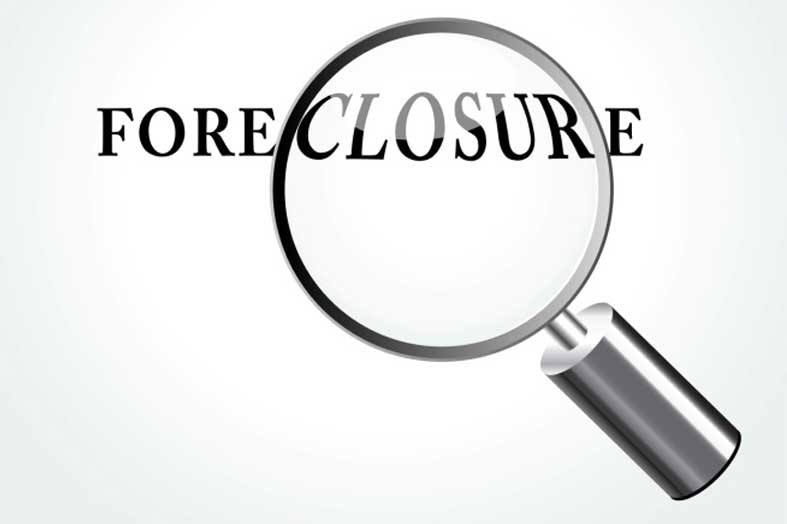
The width and height of the screenshot is (787, 524). What are the coordinates of `handle` in the screenshot? It's located at (637, 390).